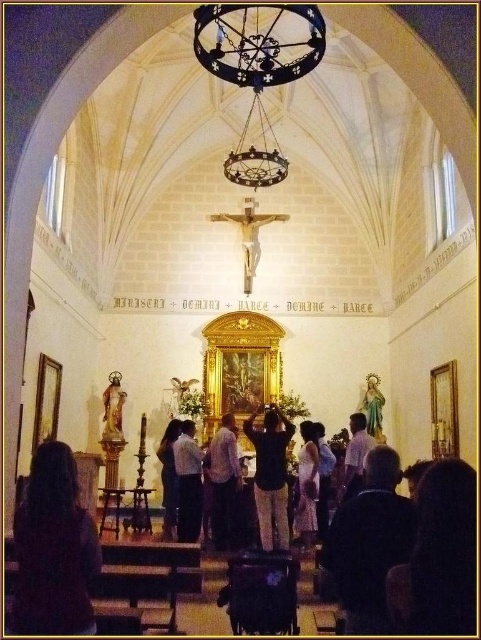
You are an observer standing in the church and notice two elements in the scene. The first is the dark brown hair at lower left and the second is the white shirt at center. Which of these two elements appears taller in the image?

The dark brown hair at lower left appears taller than the white shirt at center, as stated in the description.

What is the exact location of the light blue fabric dress at center in the church interior?

The light blue fabric dress at center is located at point coordinates of [307,483].

From the picture: You are a visitor standing at the entrance of the church. You see the white shirt at center and the matte gold statue at right. Which object is closer to your right side?

The matte gold statue at right is closer to your right side because it is positioned to the right of the white shirt at center.